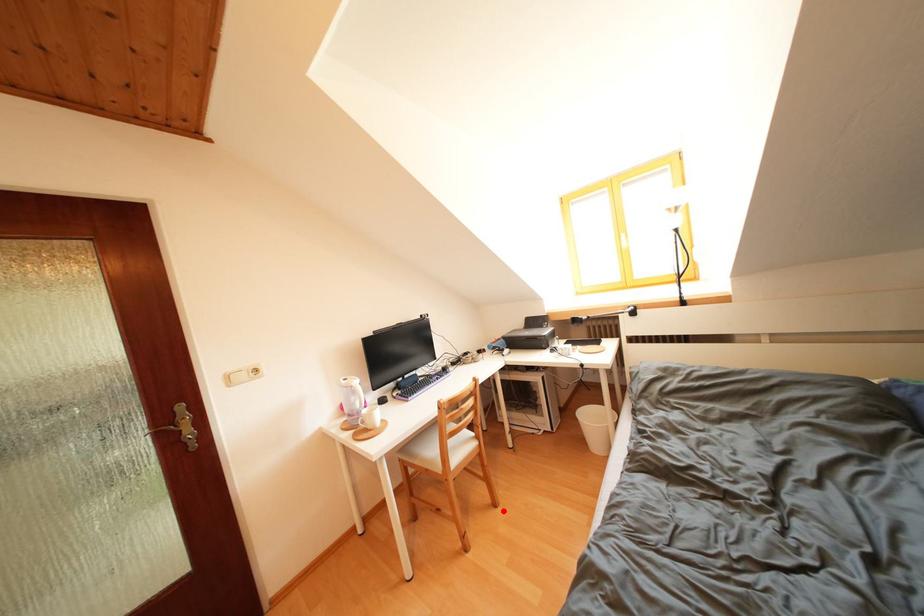
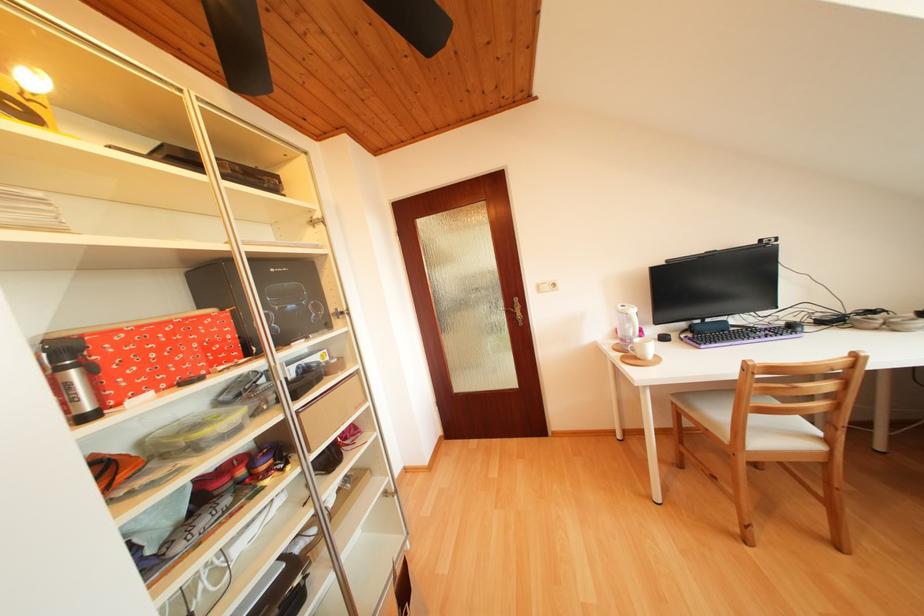
The point at the highlighted location is marked in the first image. Where is the corresponding point in the second image?

(847, 553)